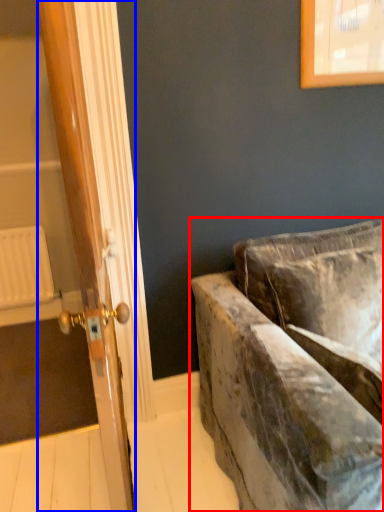
Question: Which object is further to the camera taking this photo, studio couch (highlighted by a red box) or door (highlighted by a blue box)?

Choices:
 (A) studio couch
 (B) door

Answer: (B)